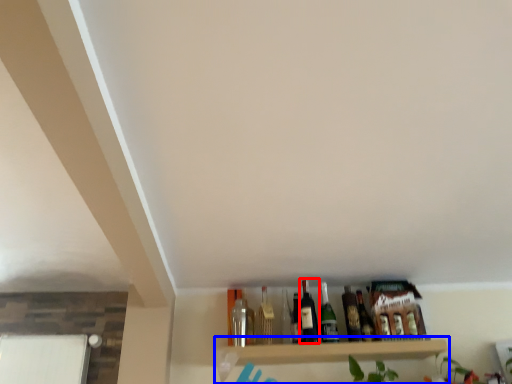
Question: Which object is closer to the camera taking this photo, beer bottle (highlighted by a red box) or shelf (highlighted by a blue box)?

Choices:
 (A) beer bottle
 (B) shelf

Answer: (B)